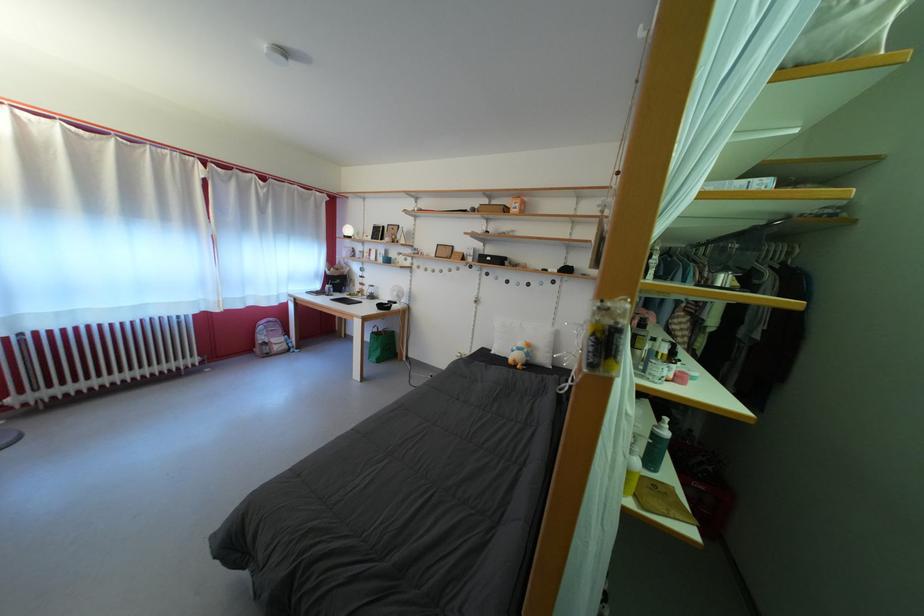
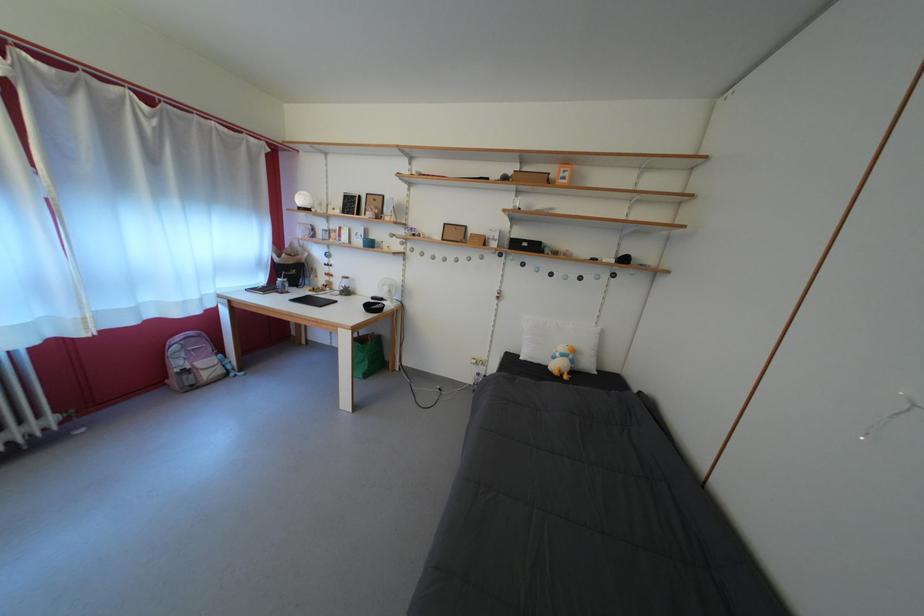
Question: The camera is either moving clockwise (left) or counter-clockwise (right) around the object. The first image is from the beginning of the video and the second image is from the end. Is the camera moving left or right when shooting the video?

Choices:
 (A) Left
 (B) Right

Answer: (A)